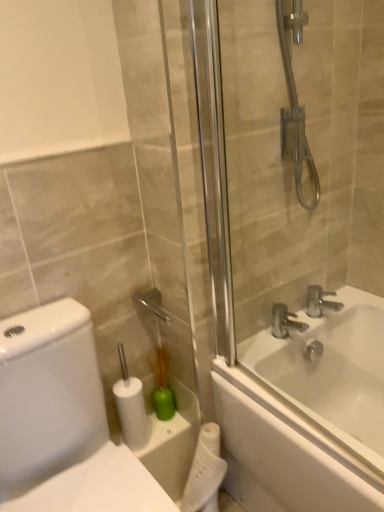
Where is `vacant space underneath transparent glass shower door at right (from a real-world perspective)`? The height and width of the screenshot is (512, 384). vacant space underneath transparent glass shower door at right (from a real-world perspective) is located at coordinates (295, 417).